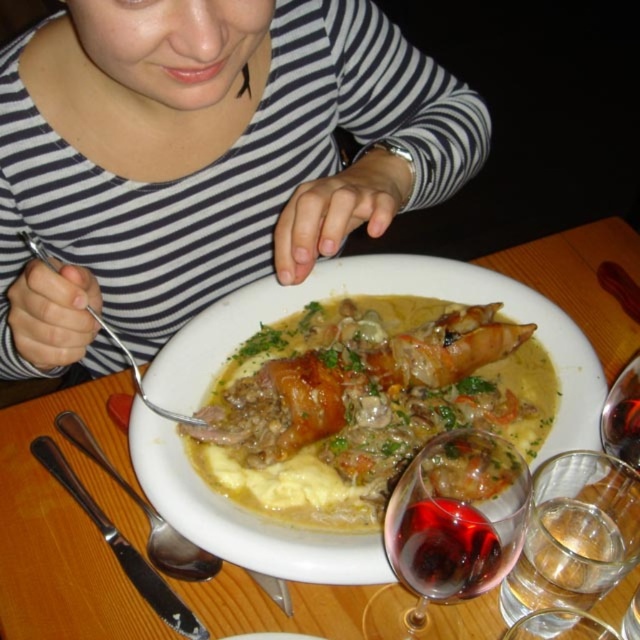
You are a waiter who needs to place a new drink order on the table. The drink must be placed in a spot that is taller than the silver spoon at center. Can you use the transparent glass at lower right for this purpose?

The transparent glass at lower right is not as tall as the silver spoon at center, so it cannot be used to place the drink order since it does not meet the height requirement.

You are a waiter who needs to place a new menu on the table. The menu is 10 cm wide. There is space between the transparent glass at lower right and the silver spoon at center. Can the menu fit there?

The transparent glass at lower right is closer to the viewer than the silver spoon at center, so the space between them is not wide enough to fit a 10 cm wide menu.